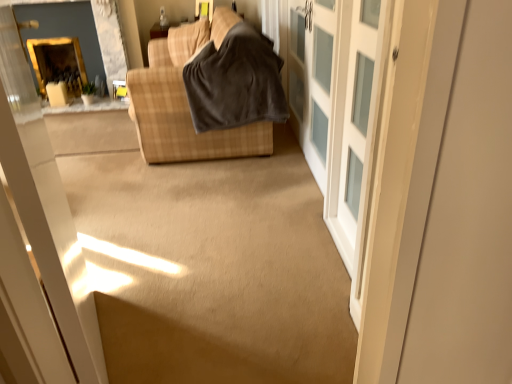
Question: From the image's perspective, would you say matte yellow window at upper center is shown under dark gray fleece blanket at center?

Choices:
 (A) yes
 (B) no

Answer: (B)

Question: Is matte yellow window at upper center surrounding dark gray fleece blanket at center?

Choices:
 (A) yes
 (B) no

Answer: (B)

Question: Does matte yellow window at upper center have a lesser height compared to dark gray fleece blanket at center?

Choices:
 (A) no
 (B) yes

Answer: (B)

Question: Is matte yellow window at upper center oriented away from dark gray fleece blanket at center?

Choices:
 (A) no
 (B) yes

Answer: (A)

Question: Considering the relative sizes of matte yellow window at upper center and dark gray fleece blanket at center in the image provided, is matte yellow window at upper center smaller than dark gray fleece blanket at center?

Choices:
 (A) no
 (B) yes

Answer: (B)

Question: Considering the positions of point (316, 6) and point (321, 145), is point (316, 6) closer or farther from the camera than point (321, 145)?

Choices:
 (A) closer
 (B) farther

Answer: (A)

Question: Based on their positions, is white frosted glass cabinet at right located to the left or right of white frosted glass barn door at center?

Choices:
 (A) right
 (B) left

Answer: (A)

Question: Would you say white frosted glass cabinet at right is inside or outside white frosted glass barn door at center?

Choices:
 (A) outside
 (B) inside

Answer: (B)

Question: Is white frosted glass cabinet at right wider or thinner than white frosted glass barn door at center?

Choices:
 (A) thin
 (B) wide

Answer: (A)

Question: Is gold-framed mirror at upper left in front of or behind dark gray fleece blanket at center in the image?

Choices:
 (A) front
 (B) behind

Answer: (B)

Question: Based on their sizes in the image, would you say gold-framed mirror at upper left is bigger or smaller than dark gray fleece blanket at center?

Choices:
 (A) small
 (B) big

Answer: (A)

Question: Considering the positions of point (74, 46) and point (203, 86), is point (74, 46) closer or farther from the camera than point (203, 86)?

Choices:
 (A) closer
 (B) farther

Answer: (B)

Question: Looking at their shapes, would you say gold-framed mirror at upper left is wider or thinner than dark gray fleece blanket at center?

Choices:
 (A) wide
 (B) thin

Answer: (B)

Question: From the image's perspective, is white frosted glass cabinet at right located above or below matte yellow window at upper center?

Choices:
 (A) below
 (B) above

Answer: (A)

Question: Is point (323, 167) positioned closer to the camera than point (208, 1)?

Choices:
 (A) closer
 (B) farther

Answer: (A)